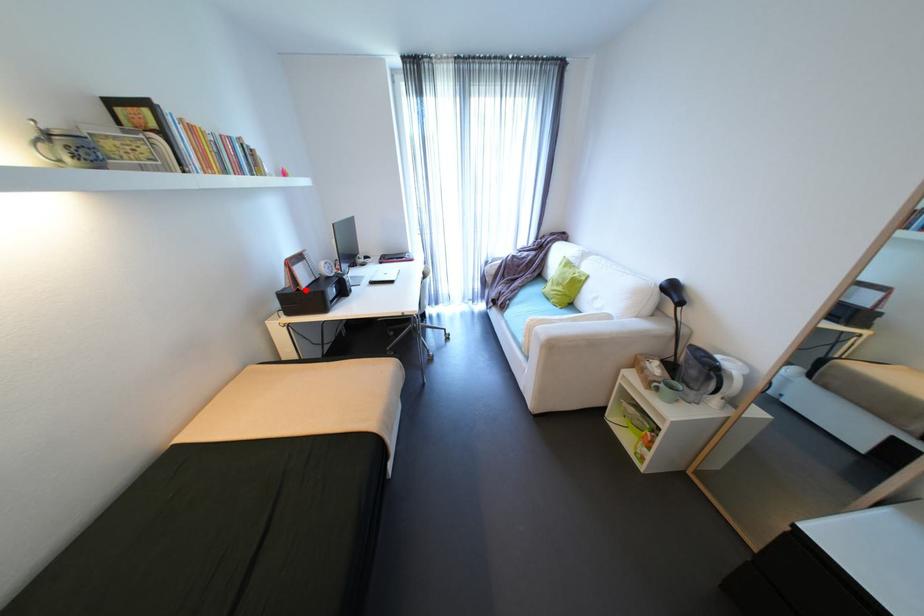
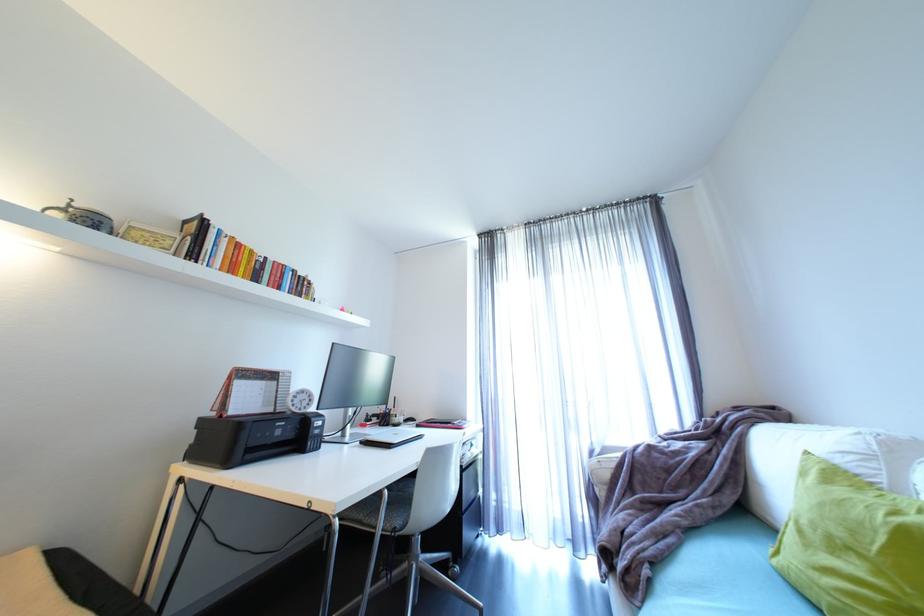
Question: I am providing you with two images of the same scene from different viewpoints. A red point is marked on the first image. At the location where the point appears in image 1, is it still visible in image 2?

Choices:
 (A) Yes
 (B) No

Answer: (A)